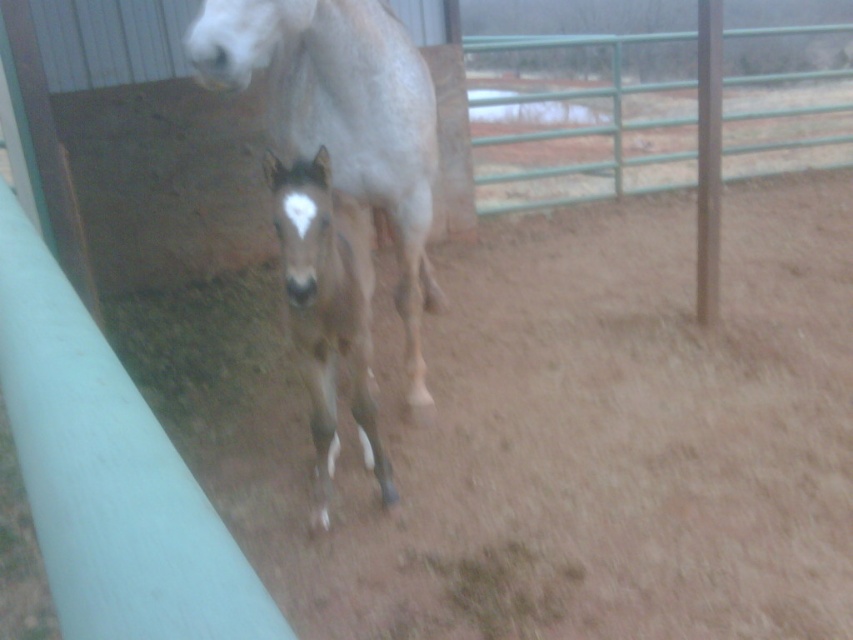
Does brown matte horse at center have a lesser height compared to brown speckled coat at center?

No.

Which is behind, point (346, 0) or point (315, 481)?

The point (315, 481) is more distant.

This screenshot has width=853, height=640. Identify the location of brown matte horse at center. click(341, 118).